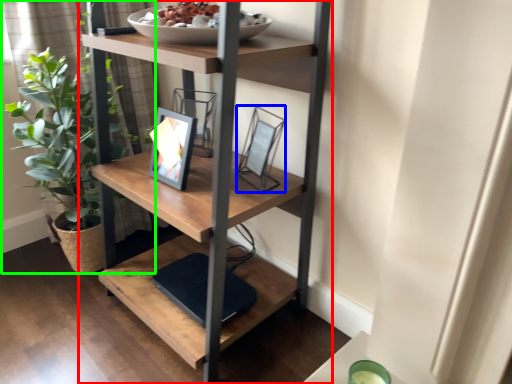
Question: Estimate the real-world distances between objects in this image. Which object is closer to shelf (highlighted by a red box), picture frame (highlighted by a blue box) or houseplant (highlighted by a green box)?

Choices:
 (A) picture frame
 (B) houseplant

Answer: (A)